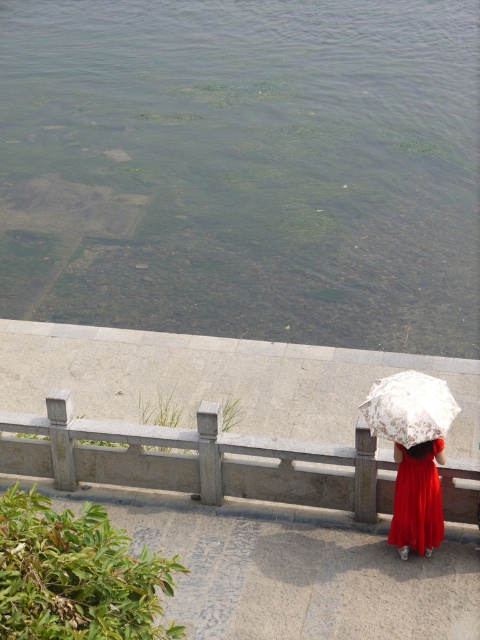
Measure the distance between point (342, 113) and camera.

Point (342, 113) and camera are 21.32 meters apart from each other.

Which is more to the right, green algae at upper center or white lace umbrella at lower right?

From the viewer's perspective, white lace umbrella at lower right appears more on the right side.

Where is `green algae at upper center`? The height and width of the screenshot is (640, 480). green algae at upper center is located at coordinates (243, 168).

Between gray stone railing at lower center and white lace umbrella at lower right, which one has more height?

Standing taller between the two is gray stone railing at lower center.

Can you confirm if gray stone railing at lower center is positioned above white lace umbrella at lower right?

No, gray stone railing at lower center is not above white lace umbrella at lower right.

Does point (327, 458) lie behind point (437, 401)?

That is True.

Image resolution: width=480 pixels, height=640 pixels. I want to click on gray stone railing at lower center, so click(197, 460).

Does white lace umbrella at lower right lie in front of matte red dress at lower right?

Yes, it is in front of matte red dress at lower right.

Based on the photo, is white lace umbrella at lower right bigger than matte red dress at lower right?

Actually, white lace umbrella at lower right might be smaller than matte red dress at lower right.

Image resolution: width=480 pixels, height=640 pixels. What do you see at coordinates (408, 406) in the screenshot?
I see `white lace umbrella at lower right` at bounding box center [408, 406].

Image resolution: width=480 pixels, height=640 pixels. I want to click on white lace umbrella at lower right, so click(408, 406).